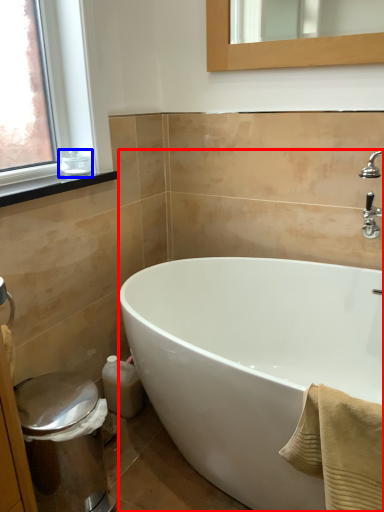
Question: Which object is further to the camera taking this photo, bathtub (highlighted by a red box) or toiletry (highlighted by a blue box)?

Choices:
 (A) bathtub
 (B) toiletry

Answer: (B)